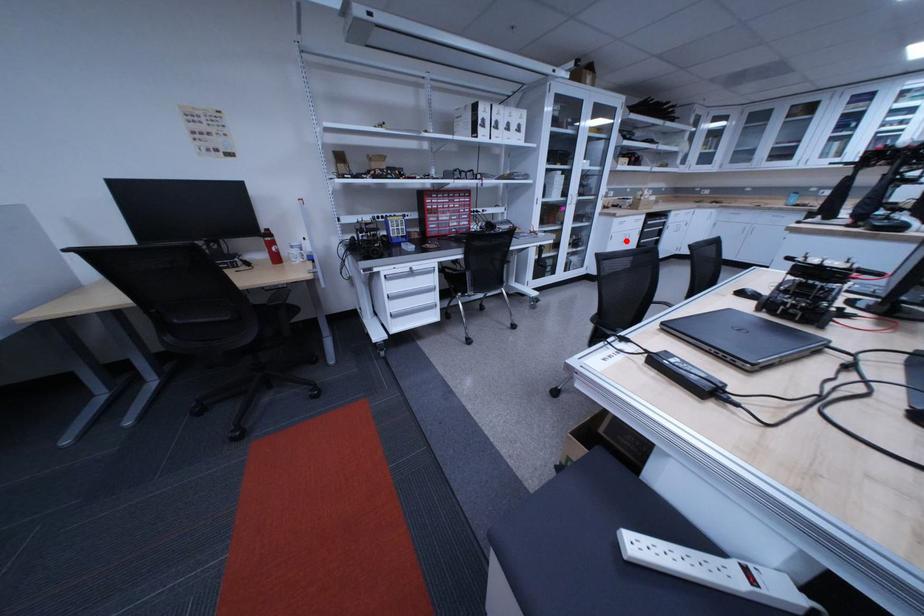
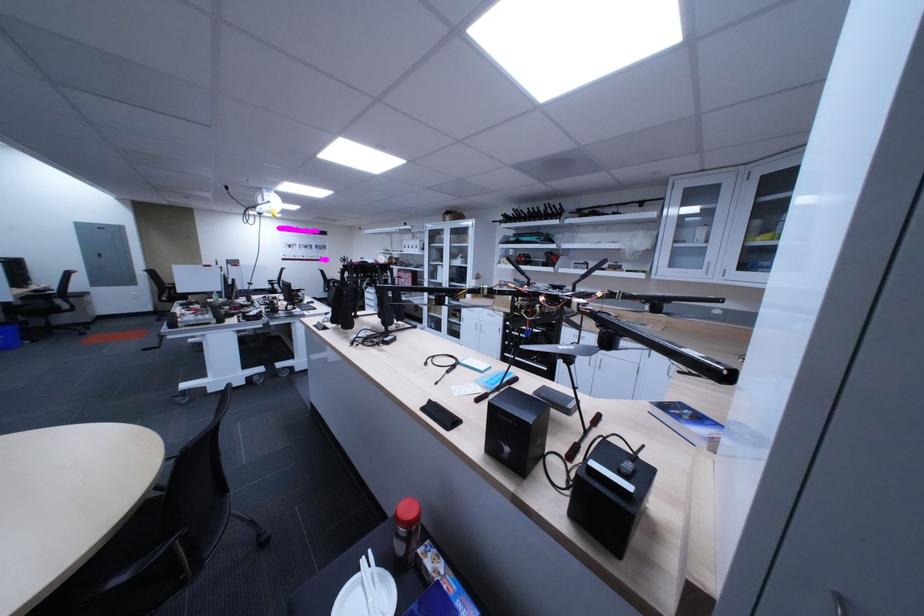
Question: A red point is marked in image1. In image2, is the corresponding 3D point closer to the camera or farther? Reply with the corresponding letter.

Choices:
 (A) The corresponding 3D point is closer.
 (B) The corresponding 3D point is farther.

Answer: (B)